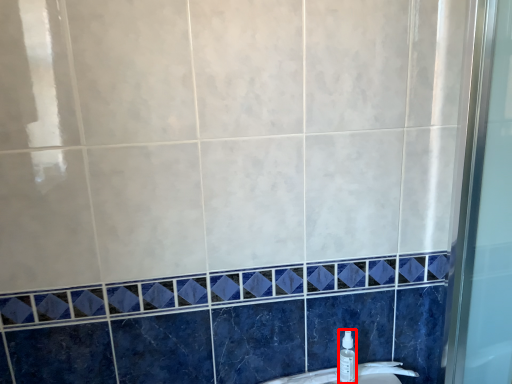
Question: From the image's perspective, what is the correct spatial relationship of toiletry (annotated by the red box) in relation to sink?

Choices:
 (A) above
 (B) below

Answer: (A)